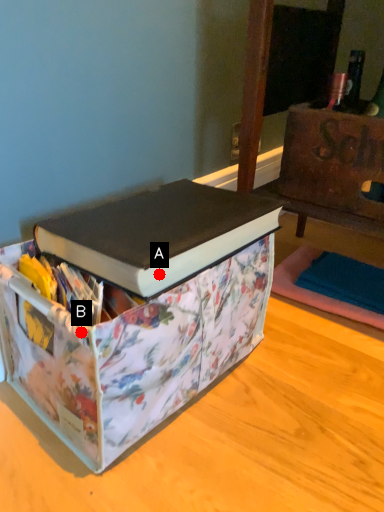
Question: Two points are circled on the image, labeled by A and B beside each circle. Which point is further to the camera?

Choices:
 (A) A is further
 (B) B is further

Answer: (A)